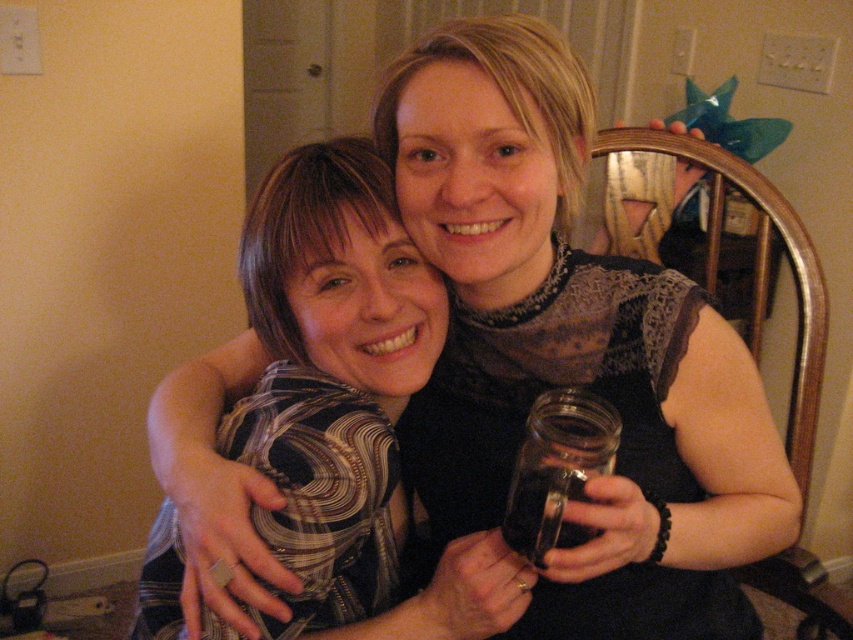
Which is below, patterned fabric shirt at center or transparent glass jar at center?

transparent glass jar at center is lower down.

Is point (375, 476) more distant than point (527, 493)?

Yes, point (375, 476) is farther from viewer.

At what (x,y) coordinates should I click in order to perform the action: click on patterned fabric shirt at center. Please return your answer as a coordinate pair (x, y). This screenshot has height=640, width=853. Looking at the image, I should click on (355, 385).

Is point (419, 616) farther from viewer compared to point (799, 262)?

No, (419, 616) is in front of (799, 262).

This screenshot has width=853, height=640. In order to click on patterned fabric shirt at center in this screenshot , I will do `click(355, 385)`.

From the picture: Measure the distance between point (809, 349) and camera.

They are 3.96 feet apart.

The image size is (853, 640). I want to click on wooden chair at upper right, so click(x=792, y=268).